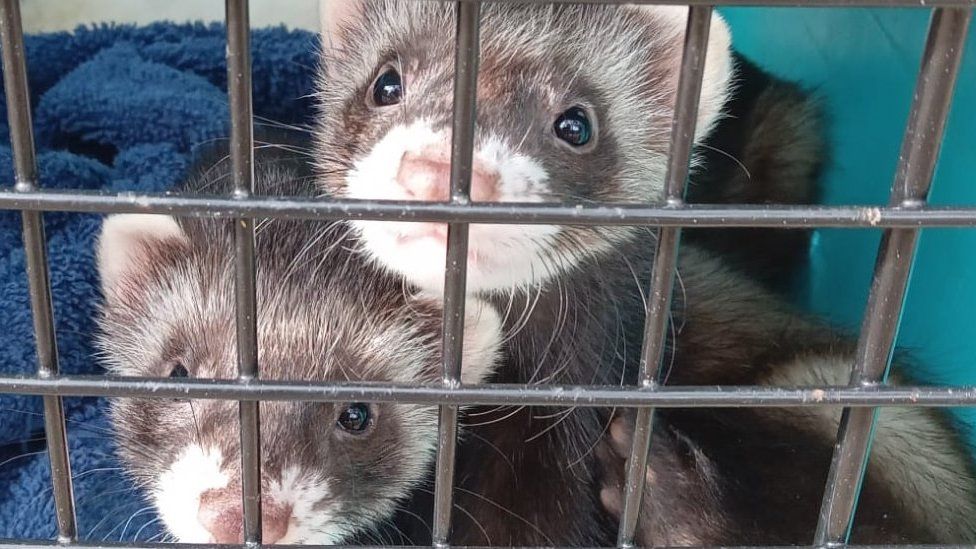
I want to click on blanket, so tap(113, 112).